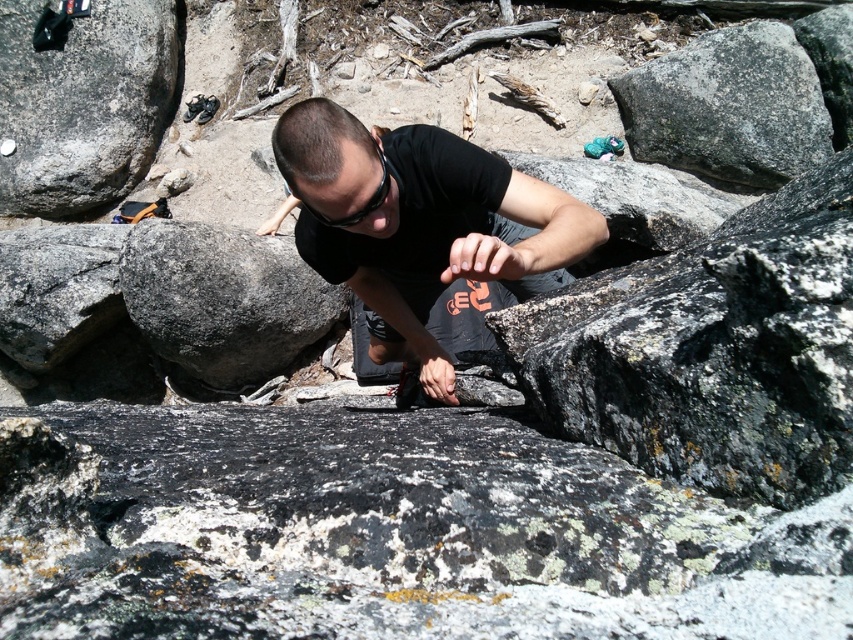
Question: Which object is farther from the camera taking this photo?

Choices:
 (A) gray rough rock at left
 (B) smooth gray rock at left
 (C) gray rough boulder at center-left
 (D) black matte shirt at center

Answer: (B)

Question: Among these points, which one is farthest from the camera?

Choices:
 (A) (90, 20)
 (B) (434, 253)
 (C) (248, 259)
 (D) (51, 241)

Answer: (A)

Question: Can you confirm if gray rough rock at upper right is positioned to the right of gray rough rock at left?

Choices:
 (A) no
 (B) yes

Answer: (B)

Question: In this image, where is smooth gray rock at left located relative to gray rough rock at upper right?

Choices:
 (A) above
 (B) below

Answer: (A)

Question: Which is farther from the gray rough rock at upper right?

Choices:
 (A) gray rough boulder at center-left
 (B) black matte shirt at center
 (C) smooth gray rock at left

Answer: (C)

Question: Considering the relative positions of black matte shirt at center and gray rough rock at left in the image provided, where is black matte shirt at center located with respect to gray rough rock at left?

Choices:
 (A) above
 (B) below

Answer: (B)